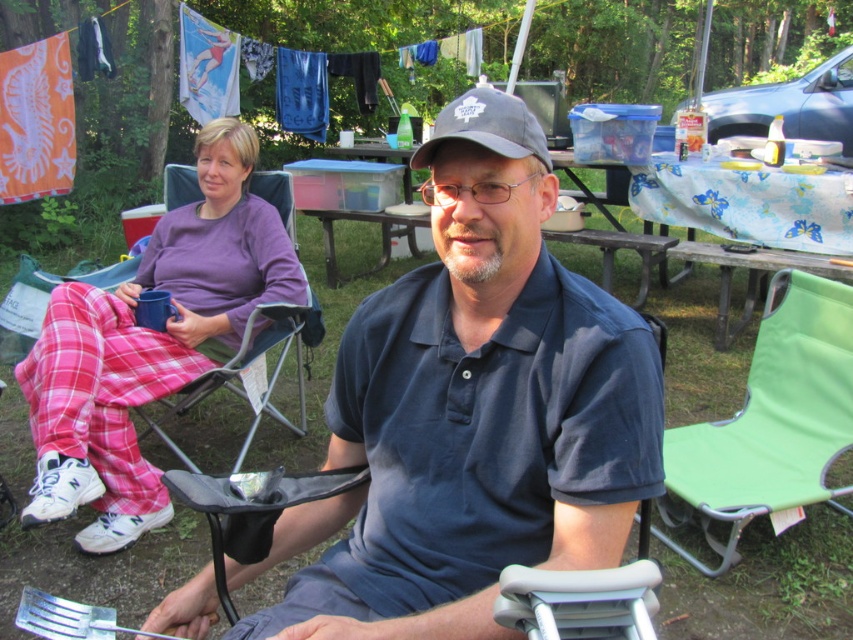
Question: Which object is closer to the camera taking this photo?

Choices:
 (A) pink plaid pants at left
 (B) dark blue cotton polo shirt at center

Answer: (B)

Question: Can you confirm if blue plastic picnic table at center is positioned above gray fabric baseball cap at center?

Choices:
 (A) yes
 (B) no

Answer: (A)

Question: Which point is closer to the camera?

Choices:
 (A) gray fabric baseball cap at center
 (B) pink plaid pants at left
 (C) green fabric folding chair at lower right
 (D) dark blue cotton polo shirt at center

Answer: (D)

Question: Is pink plaid pants at left positioned behind green fabric folding chair at lower right?

Choices:
 (A) yes
 (B) no

Answer: (B)

Question: Which object is farther from the camera taking this photo?

Choices:
 (A) blue plastic picnic table at center
 (B) dark blue cotton polo shirt at center

Answer: (A)

Question: Can you confirm if blue plastic picnic table at center is positioned to the right of gray fabric baseball cap at center?

Choices:
 (A) yes
 (B) no

Answer: (A)